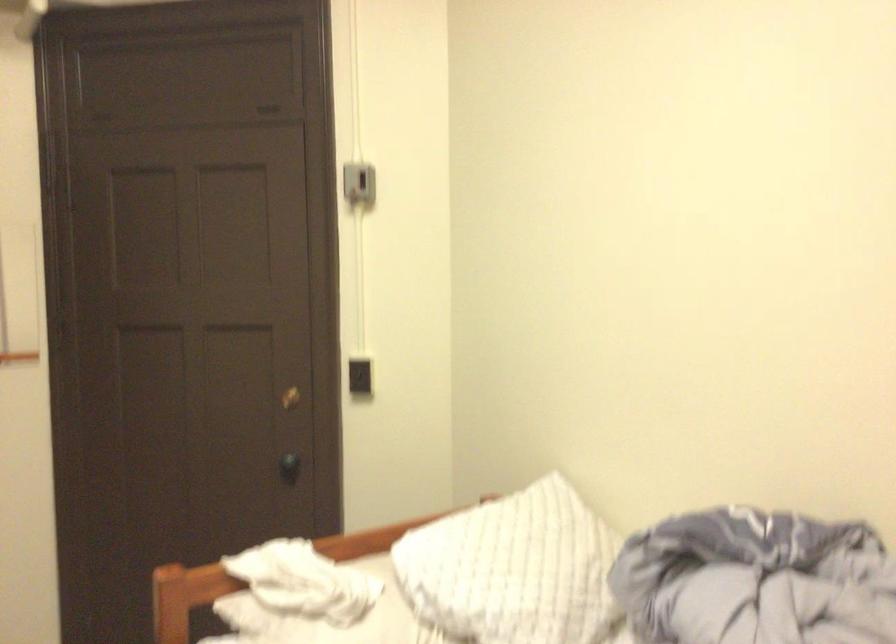
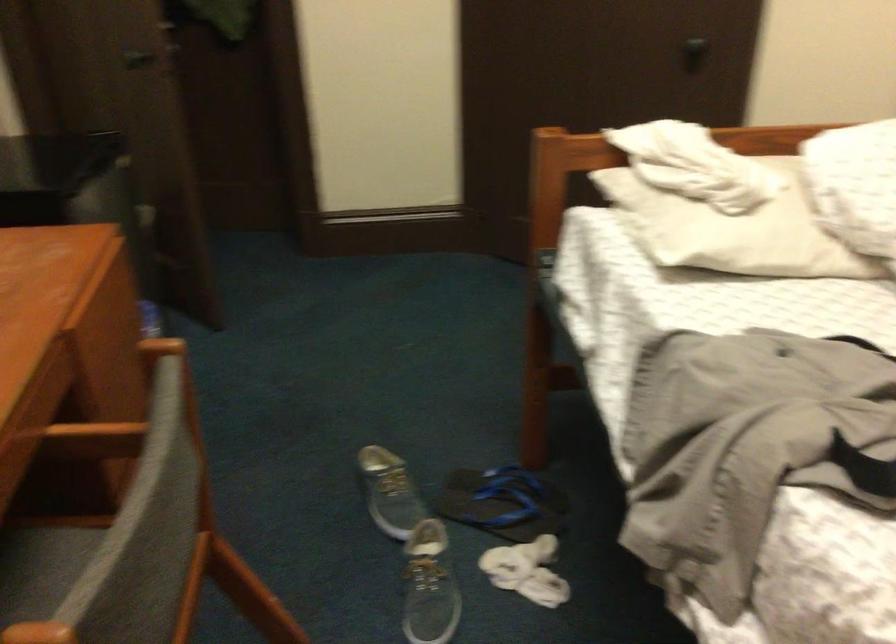
How did the camera likely rotate?

The camera's rotation is toward left-down.